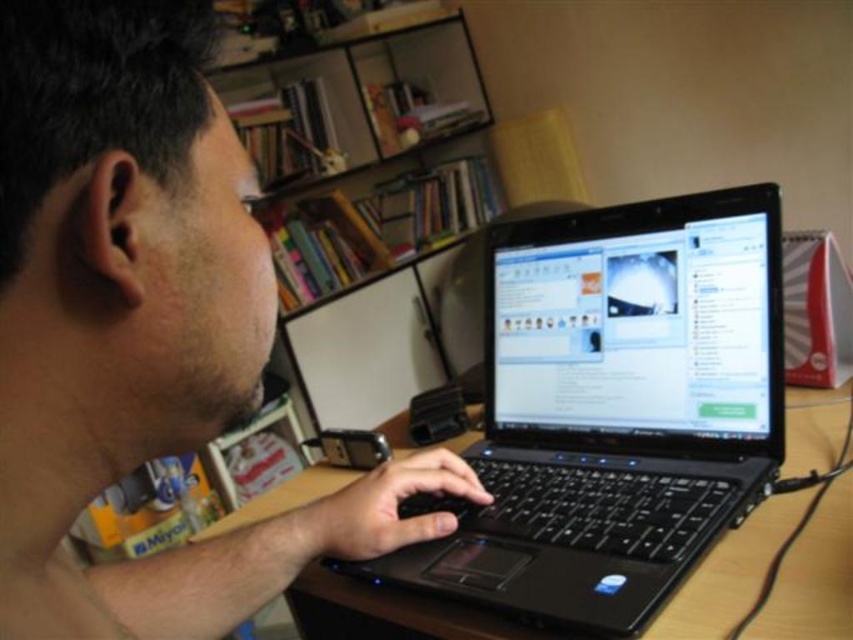
Which is below, wooden shelves at upper center or wooden table at center?

wooden table at center is lower down.

Is point (286, 237) behind point (660, 612)?

Yes, it is behind point (660, 612).

In order to click on wooden shelves at upper center in this screenshot , I will do `click(363, 152)`.

Does black plastic laptop at center have a greater width compared to shiny black laptop screen at center?

Correct, the width of black plastic laptop at center exceeds that of shiny black laptop screen at center.

How distant is black plastic laptop at center from shiny black laptop screen at center?

black plastic laptop at center and shiny black laptop screen at center are 1.49 inches apart.

Is point (515, 429) less distant than point (558, 372)?

No, it is not.

What are the coordinates of `black plastic laptop at center` in the screenshot? It's located at (614, 408).

Is matte black laptop at center positioned before shiny black laptop screen at center?

Yes, matte black laptop at center is closer to the viewer.

Who is positioned more to the right, matte black laptop at center or shiny black laptop screen at center?

Positioned to the right is shiny black laptop screen at center.

You are a GUI agent. You are given a task and a screenshot of the screen. Output one action in this format:
    pyautogui.click(x=<x>, y=<y>)
    Task: Click on the matte black laptop at center
    This screenshot has width=853, height=640.
    Given the screenshot: What is the action you would take?
    pyautogui.click(x=143, y=326)